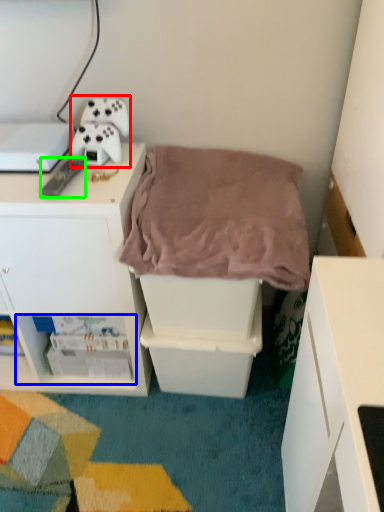
Question: Which object is the closest to the equipment (highlighted by a red box)? Choose among these: shelf (highlighted by a blue box) or remote control (highlighted by a green box).

Choices:
 (A) shelf
 (B) remote control

Answer: (B)